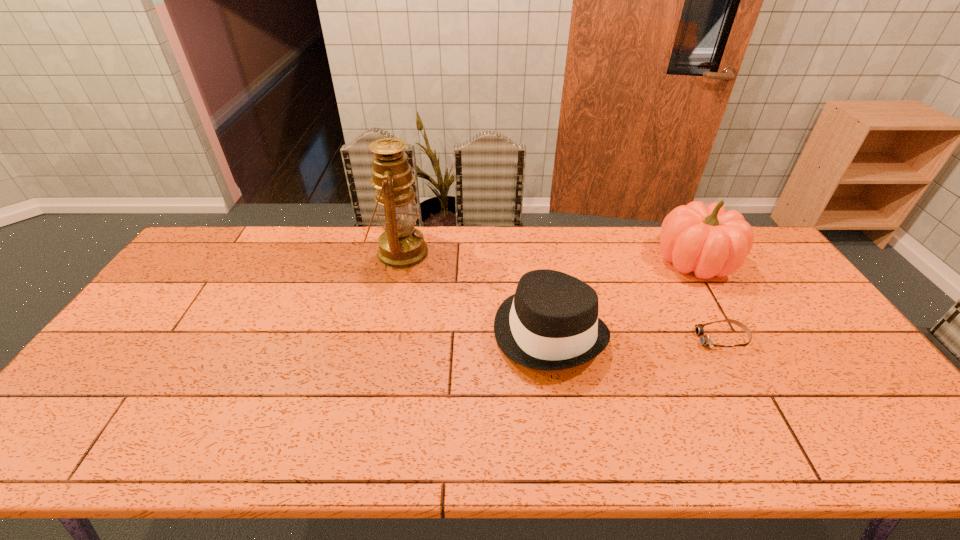
The width and height of the screenshot is (960, 540). What are the coordinates of `the tallest object` in the screenshot? It's located at (401, 246).

Where is `oil lamp`? Image resolution: width=960 pixels, height=540 pixels. oil lamp is located at coordinates (401, 246).

Identify the location of pumpkin. (709, 241).

Identify the location of the third tallest object. (551, 323).

Identify the location of the third object from right to left. (551, 323).

Locate an element on the screen. The width and height of the screenshot is (960, 540). goggles is located at coordinates (705, 340).

Identify the location of vacant space located on the right of the leftmost object. This screenshot has height=540, width=960. (518, 253).

Identify the location of free space located on the left of the third shortest object. This screenshot has width=960, height=540. (544, 261).

The image size is (960, 540). I want to click on vacant space situated 0.200m on the back of the third tallest object, so [x=537, y=252].

What are the coordinates of `vacant space located 0.100m on the front-facing side of the goggles` in the screenshot? It's located at (661, 339).